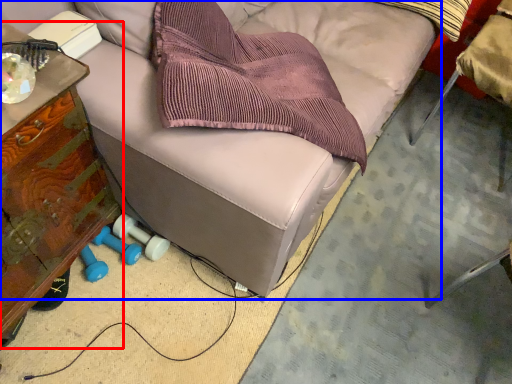
Question: Which of the following is the farthest to the observer, furniture (highlighted by a red box) or furniture (highlighted by a blue box)?

Choices:
 (A) furniture
 (B) furniture

Answer: (B)